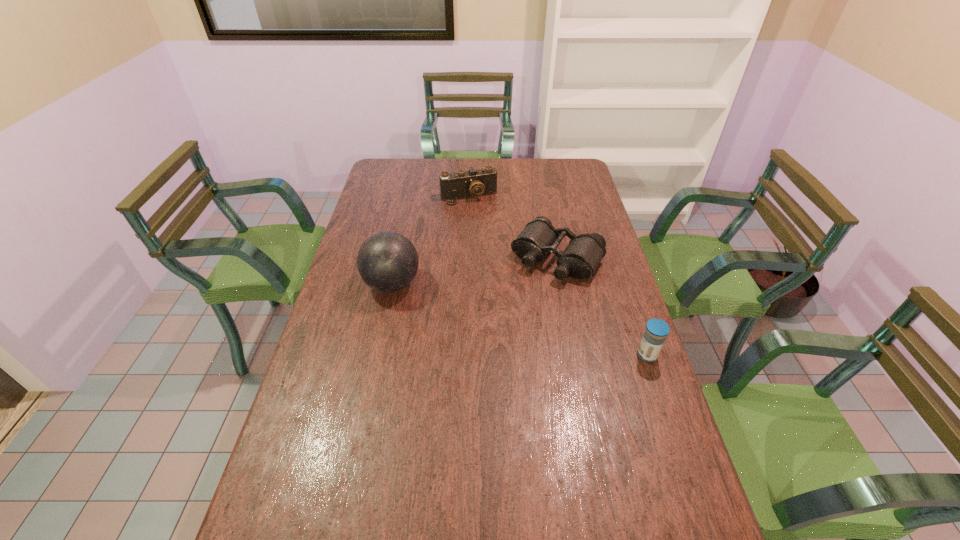
You are a GUI agent. You are given a task and a screenshot of the screen. Output one action in this format:
    pyautogui.click(x=<x>, y=<y>)
    Task: Click on the vacant space on the desktop that is between the bowling ball and the rightmost object and is positioned on the front-facing side of the farthest object
    This screenshot has height=540, width=960.
    Given the screenshot: What is the action you would take?
    pyautogui.click(x=524, y=321)

Locate an element on the screen. vacant space on the desktop that is between the tallest object and the nearest object and is positioned through the eyepieces of the third object from left to right is located at coordinates (515, 318).